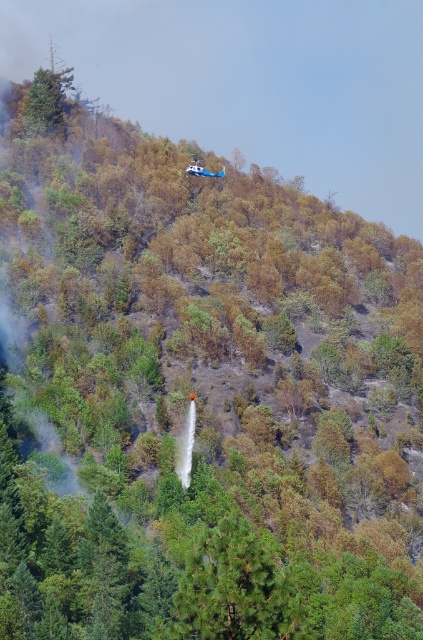
Does green matte tree at center have a lesser height compared to green matte tree at upper left?

Yes, green matte tree at center is shorter than green matte tree at upper left.

Between green matte tree at center and green matte tree at upper left, which one appears on the right side from the viewer's perspective?

green matte tree at center is more to the right.

Does point (230, 518) come closer to viewer compared to point (49, 116)?

That is True.

Identify the location of green matte tree at center. (236, 589).